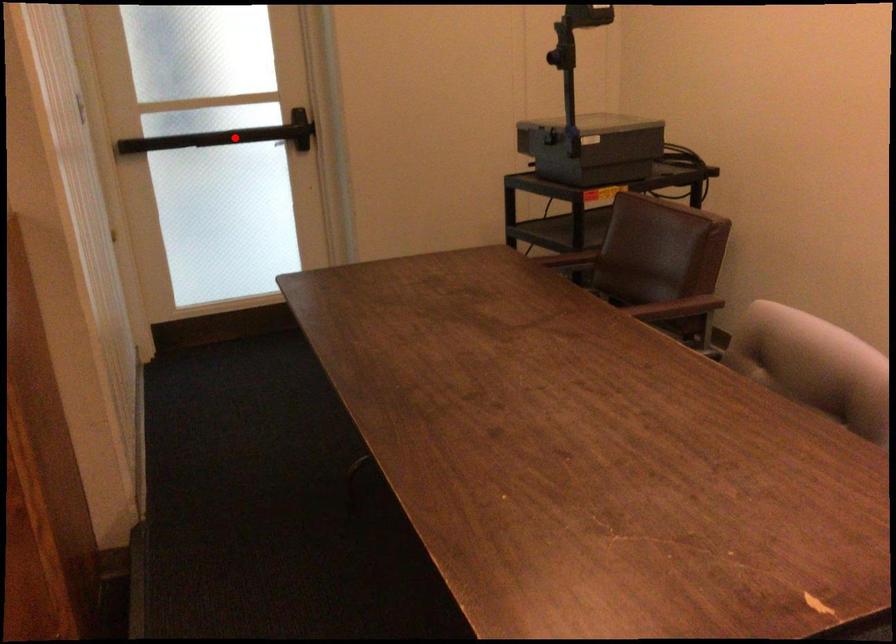
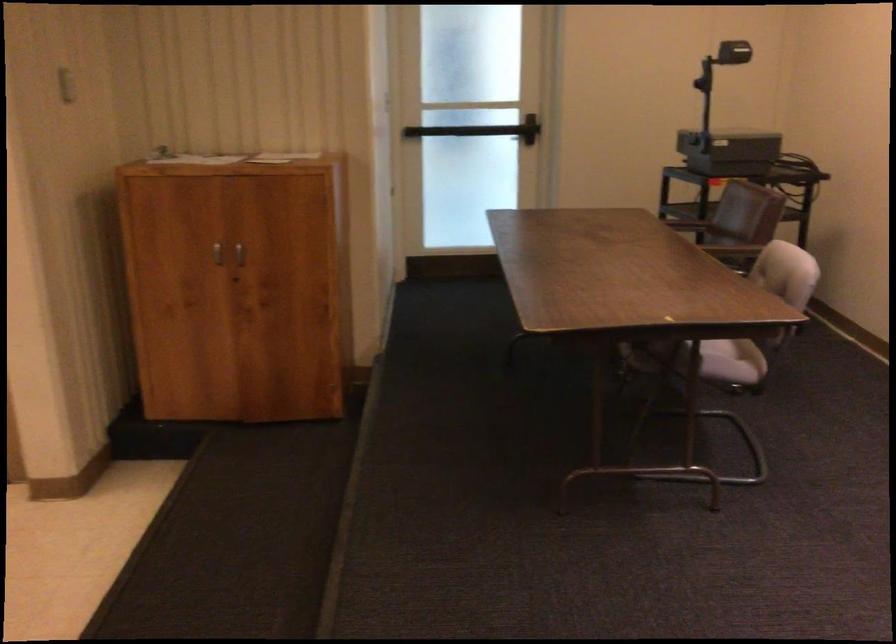
Question: A red point is marked in image1. In image2, is the corresponding 3D point closer to the camera or farther? Reply with the corresponding letter.

Choices:
 (A) The corresponding 3D point is closer.
 (B) The corresponding 3D point is farther.

Answer: (B)